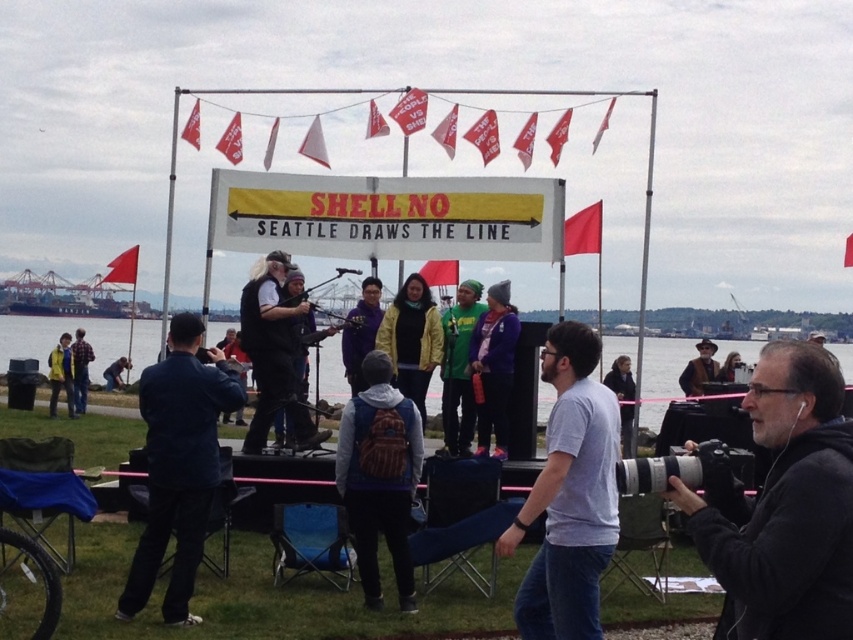
Question: Is gray cotton t-shirt at center further to the viewer compared to brown leather jacket at center?

Choices:
 (A) yes
 (B) no

Answer: (B)

Question: Which of the following is the farthest from the observer?

Choices:
 (A) green grass at lower center
 (B) black matte camera at lower right
 (C) dark blue jacket at left

Answer: (C)

Question: Observing the image, what is the correct spatial positioning of dark blue jacket at left in reference to green grass at lower center?

Choices:
 (A) below
 (B) above

Answer: (A)

Question: Is gray cotton t-shirt at center above dark blue jacket at left?

Choices:
 (A) yes
 (B) no

Answer: (A)

Question: Which point is farther to the camera?

Choices:
 (A) (608, 401)
 (B) (144, 385)

Answer: (B)

Question: Among these objects, which one is farthest from the camera?

Choices:
 (A) brown leather jacket at center
 (B) dark blue jacket at left
 (C) green grass at lower center
 (D) black matte camera at lower right

Answer: (A)